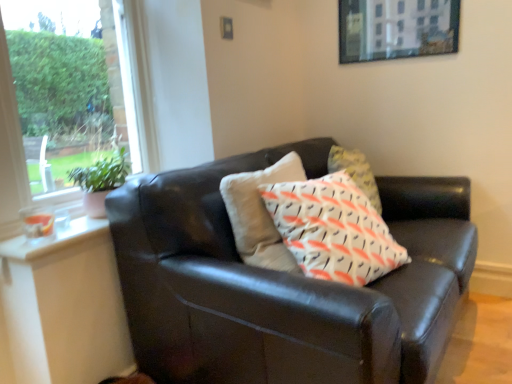
Question: Would you say matte black couch at center is part of clear glass window at upper left's contents?

Choices:
 (A) no
 (B) yes

Answer: (A)

Question: From the image's perspective, is clear glass window at upper left on matte black couch at center?

Choices:
 (A) no
 (B) yes

Answer: (B)

Question: Does clear glass window at upper left have a greater height compared to matte black couch at center?

Choices:
 (A) yes
 (B) no

Answer: (B)

Question: From a real-world perspective, is clear glass window at upper left physically below matte black couch at center?

Choices:
 (A) yes
 (B) no

Answer: (B)

Question: Is clear glass window at upper left outside matte black couch at center?

Choices:
 (A) yes
 (B) no

Answer: (A)

Question: From the image's perspective, does clear glass window at upper left appear lower than matte black couch at center?

Choices:
 (A) yes
 (B) no

Answer: (B)

Question: From a real-world perspective, is matte black couch at center on metallic silver picture frame at upper center?

Choices:
 (A) yes
 (B) no

Answer: (B)

Question: Can you confirm if matte black couch at center is positioned to the left of metallic silver picture frame at upper center?

Choices:
 (A) yes
 (B) no

Answer: (A)

Question: Is matte black couch at center smaller than metallic silver picture frame at upper center?

Choices:
 (A) no
 (B) yes

Answer: (A)

Question: Is matte black couch at center further to the viewer compared to metallic silver picture frame at upper center?

Choices:
 (A) no
 (B) yes

Answer: (A)

Question: Is metallic silver picture frame at upper center completely or partially inside matte black couch at center?

Choices:
 (A) no
 (B) yes

Answer: (A)

Question: From a real-world perspective, is matte black couch at center physically below metallic silver picture frame at upper center?

Choices:
 (A) no
 (B) yes

Answer: (B)

Question: Considering the relative sizes of metallic silver picture frame at upper center and matte black couch at center in the image provided, is metallic silver picture frame at upper center smaller than matte black couch at center?

Choices:
 (A) yes
 (B) no

Answer: (A)